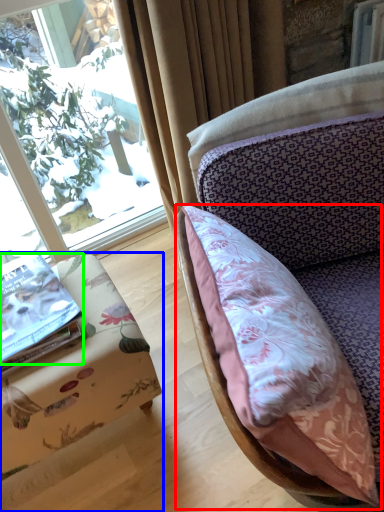
Question: Estimate the real-world distances between objects in this image. Which object is closer to pillow (highlighted by a red box), furniture (highlighted by a blue box) or book (highlighted by a green box)?

Choices:
 (A) furniture
 (B) book

Answer: (A)